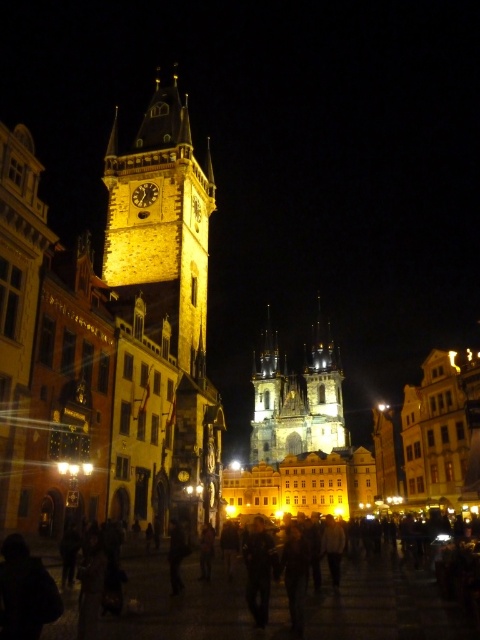
Does golden stone clock tower at center come in front of golden stone cathedral at center?

Yes, it is in front of golden stone cathedral at center.

Between point (129, 211) and point (324, 397), which one is positioned in front?

Point (129, 211)

I want to click on golden stone clock tower at center, so click(162, 221).

Where is `dark clothing crowd at center`? Image resolution: width=480 pixels, height=640 pixels. dark clothing crowd at center is located at coordinates (191, 604).

Which is in front, point (311, 588) or point (302, 436)?

Point (311, 588) is more forward.

At what (x,y) coordinates should I click in order to perform the action: click on dark clothing crowd at center. Please return your answer as a coordinate pair (x, y). Looking at the image, I should click on (191, 604).

Consider the image. Which is above, dark clothing crowd at center or golden stone clock tower at center?

golden stone clock tower at center is higher up.

Does point (415, 608) come farther from viewer compared to point (207, 156)?

No, it is in front of (207, 156).

Who is more forward, (190, 628) or (136, 182)?

Point (190, 628)

Find the location of `dark clothing crowd at center`. dark clothing crowd at center is located at coordinates (191, 604).